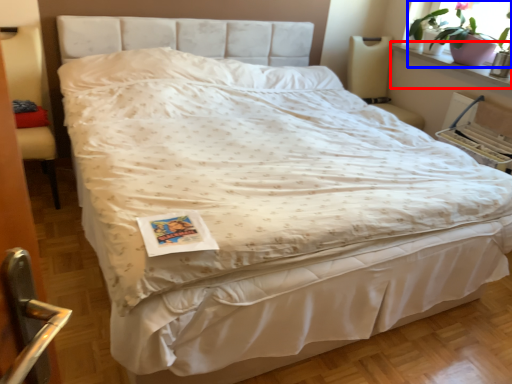
Question: Which of the following is the farthest to the observer, window sill (highlighted by a red box) or houseplant (highlighted by a blue box)?

Choices:
 (A) window sill
 (B) houseplant

Answer: (B)